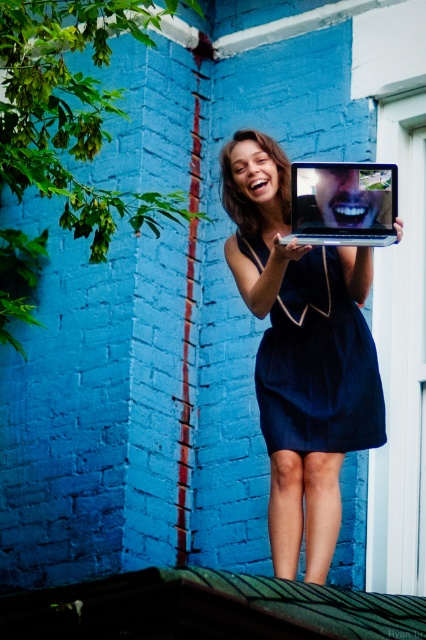
Question: Does shiny silver laptop at center appear over metallic silver laptop at center?

Choices:
 (A) yes
 (B) no

Answer: (B)

Question: Which of the following is the farthest from the observer?

Choices:
 (A) (233, 170)
 (B) (339, 209)

Answer: (A)

Question: Which object is positioned closest to the metallic silver laptop at center?

Choices:
 (A) dark blue fabric dress at center
 (B) shiny silver laptop at center

Answer: (B)

Question: Which of these objects is positioned farthest from the shiny silver laptop at center?

Choices:
 (A) metallic silver laptop at center
 (B) dark blue fabric dress at center

Answer: (A)

Question: Can you confirm if dark blue fabric dress at center is positioned above metallic silver laptop at center?

Choices:
 (A) yes
 (B) no

Answer: (B)

Question: Does shiny silver laptop at center appear on the right side of dark blue fabric dress at center?

Choices:
 (A) no
 (B) yes

Answer: (B)